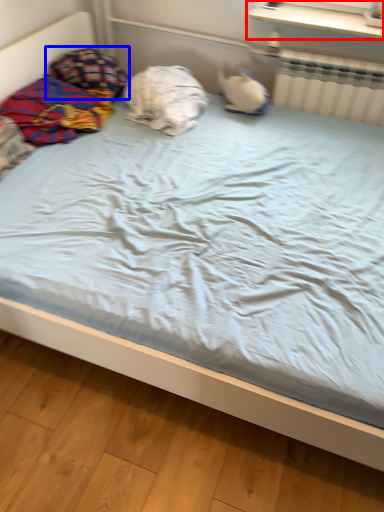
Question: Which object appears farthest to the camera in this image, window sill (highlighted by a red box) or pillow (highlighted by a blue box)?

Choices:
 (A) window sill
 (B) pillow

Answer: (B)